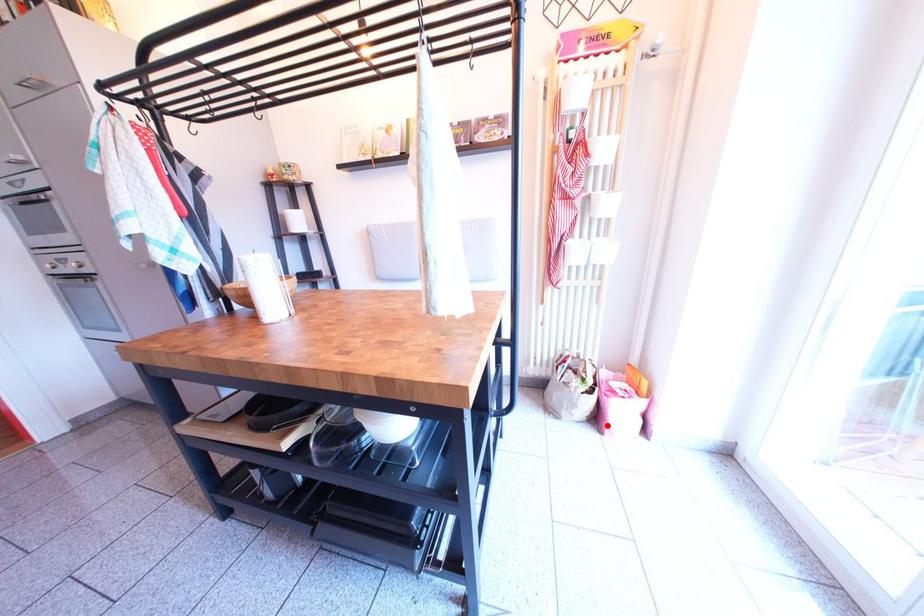
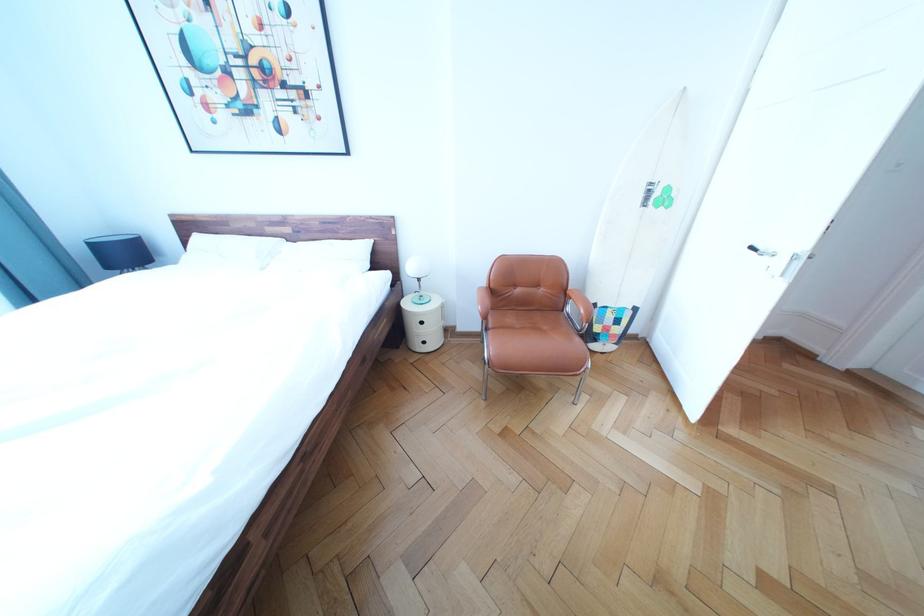
Question: I am providing you with two images of the same scene from different viewpoints. A red point is marked on the first image. At the location where the point appears in image 1, is it still visible in image 2?

Choices:
 (A) Yes
 (B) No

Answer: (B)